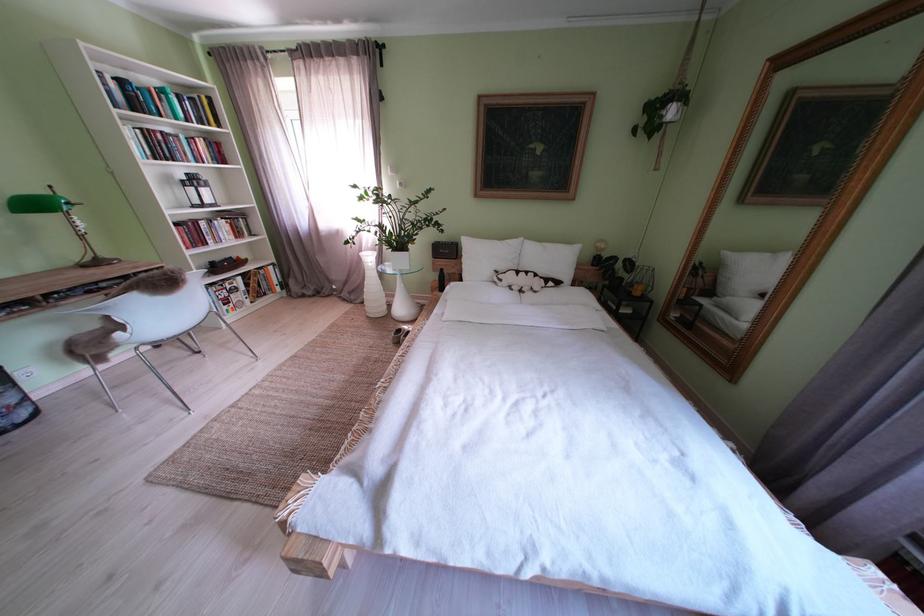
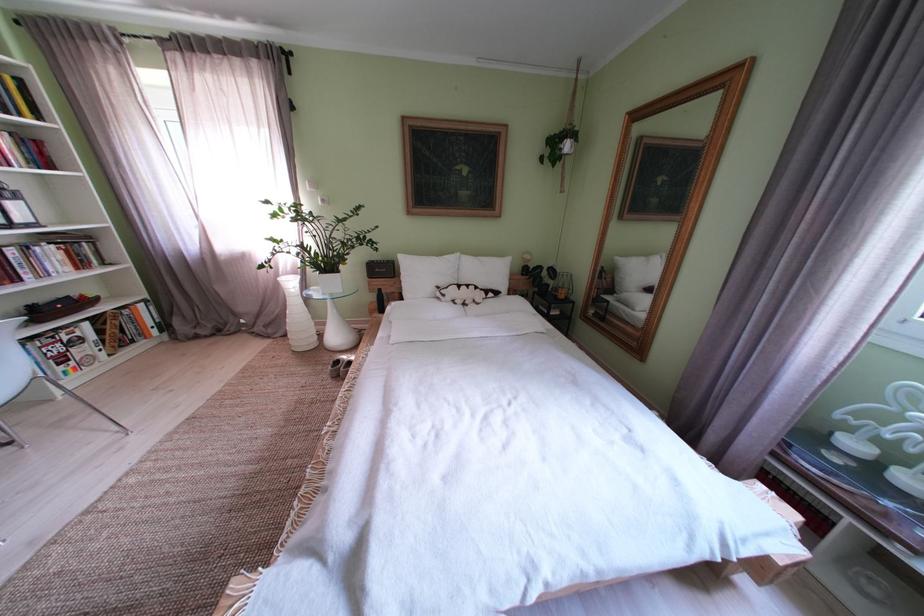
Question: How did the camera likely rotate?

Choices:
 (A) Left
 (B) Right
 (C) Up
 (D) Down

Answer: (B)